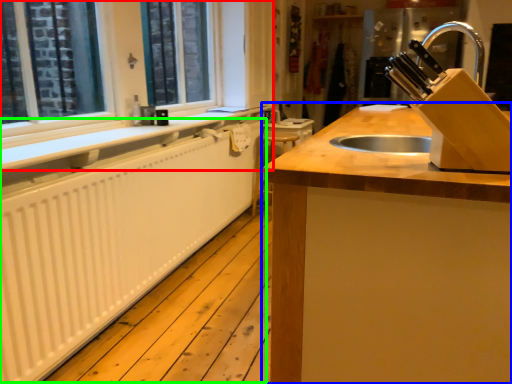
Question: Based on their relative distances, which object is farther from window frame (highlighted by a red box)? Choose from countertop (highlighted by a blue box) and radiator (highlighted by a green box).

Choices:
 (A) countertop
 (B) radiator

Answer: (A)